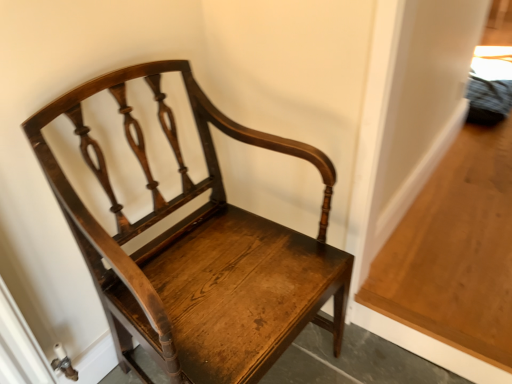
Locate an element on the screen. shiny brown wood chair at center is located at coordinates (198, 248).

The image size is (512, 384). What do you see at coordinates (198, 248) in the screenshot? I see `shiny brown wood chair at center` at bounding box center [198, 248].

Measure the distance between shiny brown wood chair at center and camera.

They are 26.38 inches apart.

I want to click on shiny brown wood chair at center, so click(198, 248).